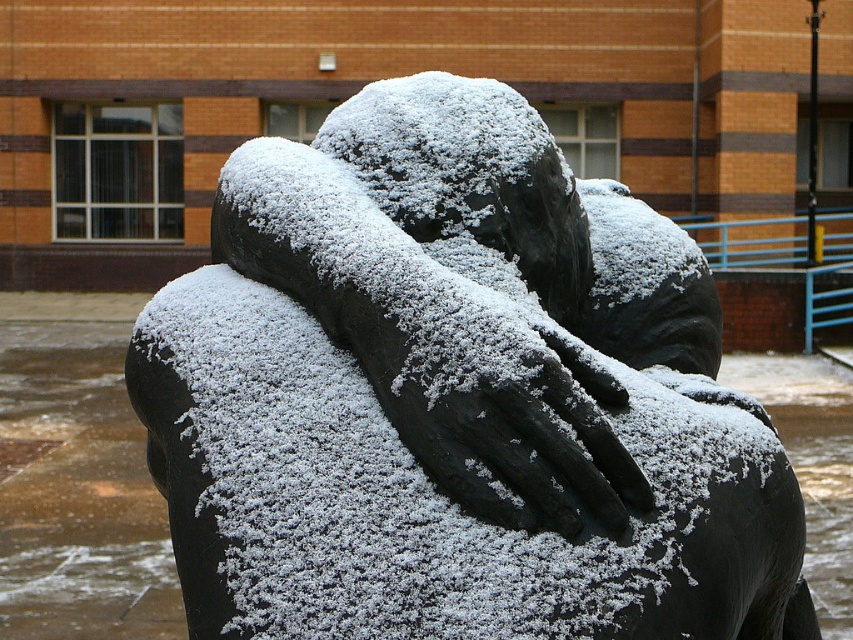
Is black matte statue at center taller than slick black hand at center?

Yes, black matte statue at center is taller than slick black hand at center.

This screenshot has width=853, height=640. What are the coordinates of `black matte statue at center` in the screenshot? It's located at (456, 397).